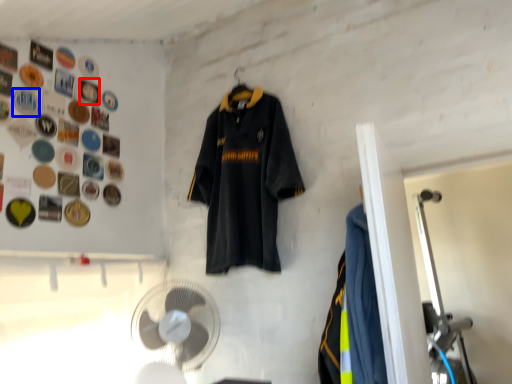
Question: Which point is further to the camera, button (highlighted by a red box) or button (highlighted by a blue box)?

Choices:
 (A) button
 (B) button

Answer: (A)